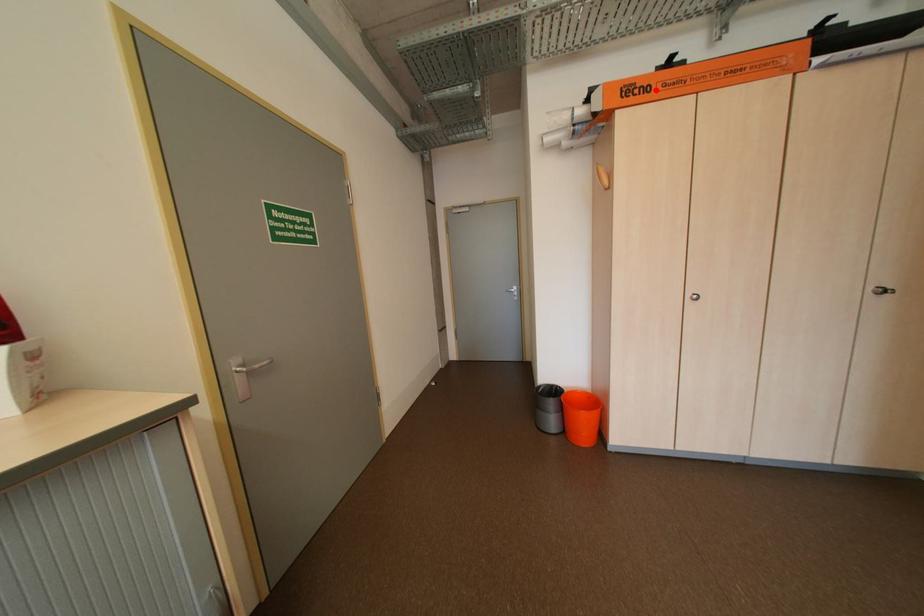
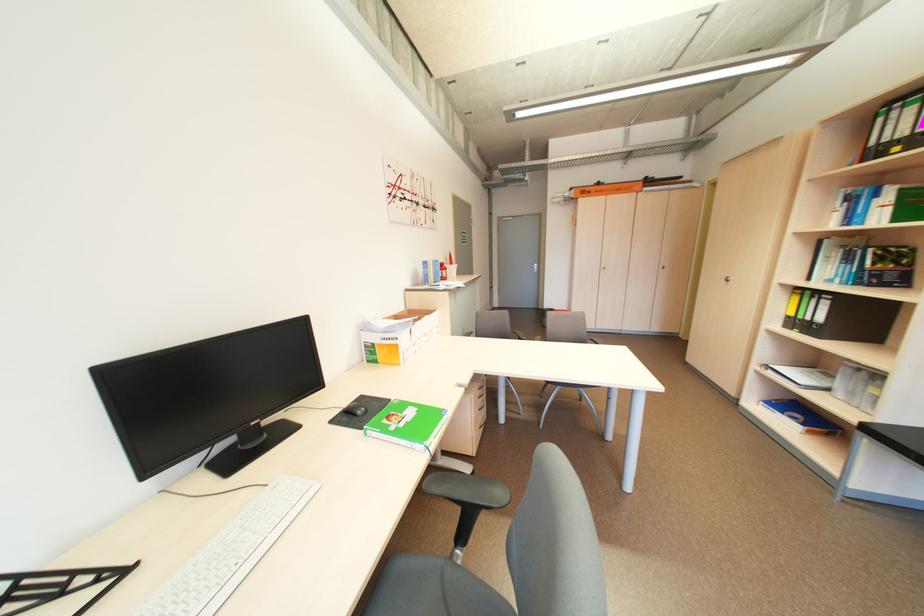
Locate, in the second image, the point that corresponds to the highlighted location in the first image.

(599, 193)